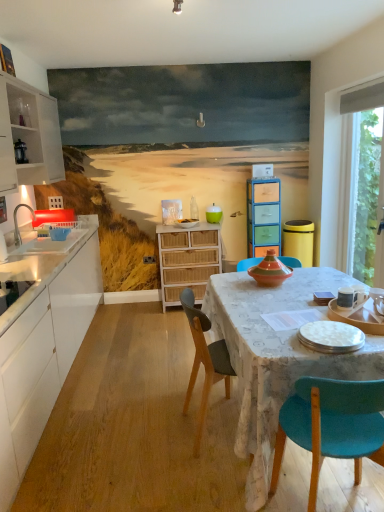
Question: From the image's perspective, is white wood cabinet at left, the first cabinetry when ordered from left to right, over white ceramic mug at upper right, which ranks as the second tableware in bottom-to-top order?

Choices:
 (A) yes
 (B) no

Answer: (A)

Question: Does white wood cabinet at left, the first cabinetry when ordered from left to right, have a smaller size compared to white ceramic mug at upper right, which appears as the 3th tableware when viewed from the left?

Choices:
 (A) no
 (B) yes

Answer: (A)

Question: From a real-world perspective, does white wood cabinet at left, the first cabinetry when ordered from left to right, sit lower than white ceramic mug at upper right, placed as the second tableware when sorted from top to bottom?

Choices:
 (A) yes
 (B) no

Answer: (B)

Question: Does white wood cabinet at left, the 3th cabinetry viewed from the right, lie in front of white ceramic mug at upper right, which appears as the 3th tableware when viewed from the left?

Choices:
 (A) yes
 (B) no

Answer: (B)

Question: Considering the relative sizes of white wood cabinet at left, the 3th cabinetry viewed from the right, and white ceramic mug at upper right, marked as the 2th tableware in a front-to-back arrangement, in the image provided, is white wood cabinet at left, the 3th cabinetry viewed from the right, thinner than white ceramic mug at upper right, marked as the 2th tableware in a front-to-back arrangement,?

Choices:
 (A) yes
 (B) no

Answer: (B)

Question: Would you say white ceramic mug at upper right, marked as the second tableware in a back-to-front arrangement, is inside or outside wooden chair at center, the second chair from the front?

Choices:
 (A) inside
 (B) outside

Answer: (B)

Question: In terms of width, does white ceramic mug at upper right, marked as the 2th tableware in a front-to-back arrangement, look wider or thinner when compared to wooden chair at center, which ranks as the second chair in right-to-left order?

Choices:
 (A) thin
 (B) wide

Answer: (A)

Question: From the image's perspective, is white ceramic mug at upper right, which ranks as the second tableware in bottom-to-top order, above or below wooden chair at center, which ranks as the second chair in right-to-left order?

Choices:
 (A) above
 (B) below

Answer: (A)

Question: Considering the positions of white ceramic mug at upper right, marked as the second tableware in a back-to-front arrangement, and wooden chair at center, the second chair from the front, in the image, is white ceramic mug at upper right, marked as the second tableware in a back-to-front arrangement, taller or shorter than wooden chair at center, the second chair from the front,?

Choices:
 (A) tall
 (B) short

Answer: (B)

Question: From the image's perspective, is white glossy plate at lower right, which appears as the 2th tableware when viewed from the left, above or below white ceramic mug at upper right, marked as the 2th tableware in a front-to-back arrangement?

Choices:
 (A) below
 (B) above

Answer: (A)

Question: Considering the positions of white glossy plate at lower right, which is the third tableware in top-to-bottom order, and white ceramic mug at upper right, placed as the second tableware when sorted from top to bottom, in the image, is white glossy plate at lower right, which is the third tableware in top-to-bottom order, wider or thinner than white ceramic mug at upper right, placed as the second tableware when sorted from top to bottom,?

Choices:
 (A) wide
 (B) thin

Answer: (A)

Question: In terms of height, does white glossy plate at lower right, the third tableware positioned from the back, look taller or shorter compared to white ceramic mug at upper right, which is the 1th tableware from right to left?

Choices:
 (A) short
 (B) tall

Answer: (A)

Question: Which is correct: white glossy plate at lower right, the third tableware positioned from the back, is inside white ceramic mug at upper right, which appears as the 3th tableware when viewed from the left, or outside of it?

Choices:
 (A) outside
 (B) inside

Answer: (A)

Question: Is white wood cabinet at left, the first cabinetry when ordered from left to right, in front of or behind teal fabric chair at lower right, marked as the first chair in a front-to-back arrangement, in the image?

Choices:
 (A) front
 (B) behind

Answer: (B)

Question: From a real-world perspective, is white wood cabinet at left, the first cabinetry when ordered from left to right, positioned above or below teal fabric chair at lower right, which appears as the 2th chair when viewed from the left?

Choices:
 (A) above
 (B) below

Answer: (A)